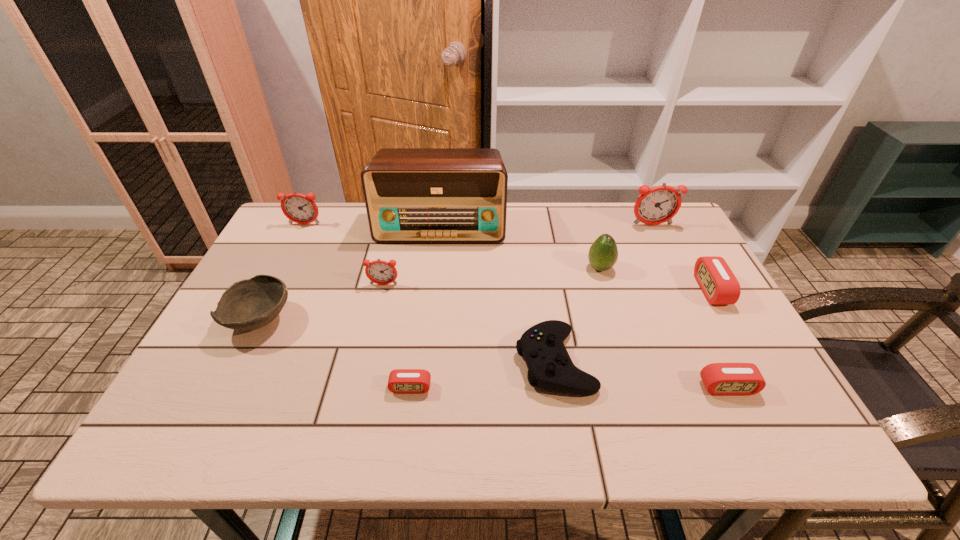
Where is `the biggest pink alarm clock`? The image size is (960, 540). the biggest pink alarm clock is located at coordinates (718, 283).

The width and height of the screenshot is (960, 540). I want to click on the farthest pink alarm clock, so click(718, 283).

Find the location of a particular element. Image resolution: width=960 pixels, height=540 pixels. control is located at coordinates (550, 367).

This screenshot has height=540, width=960. I want to click on the second biggest pink alarm clock, so click(x=725, y=379).

You are a GUI agent. You are given a task and a screenshot of the screen. Output one action in this format:
    pyautogui.click(x=<x>, y=<y>)
    Task: Click on the shortest object
    
    Given the screenshot: What is the action you would take?
    pyautogui.click(x=401, y=381)

The height and width of the screenshot is (540, 960). Identify the location of the leftmost pink alarm clock. (401, 381).

Where is `free region located on the front-facing side of the tallest object`? free region located on the front-facing side of the tallest object is located at coordinates (436, 268).

At what (x,y) coordinates should I click in order to perform the action: click on vacant space located 0.130m on the front-facing side of the rightmost reddish-pink alarm clock. Please return your answer as a coordinate pair (x, y). Looking at the image, I should click on (666, 254).

In order to click on free space located on the front-facing side of the leftmost alarm clock in this screenshot , I will do `click(262, 308)`.

This screenshot has width=960, height=540. I want to click on vacant space located 0.180m on the back of the avocado, so click(x=587, y=224).